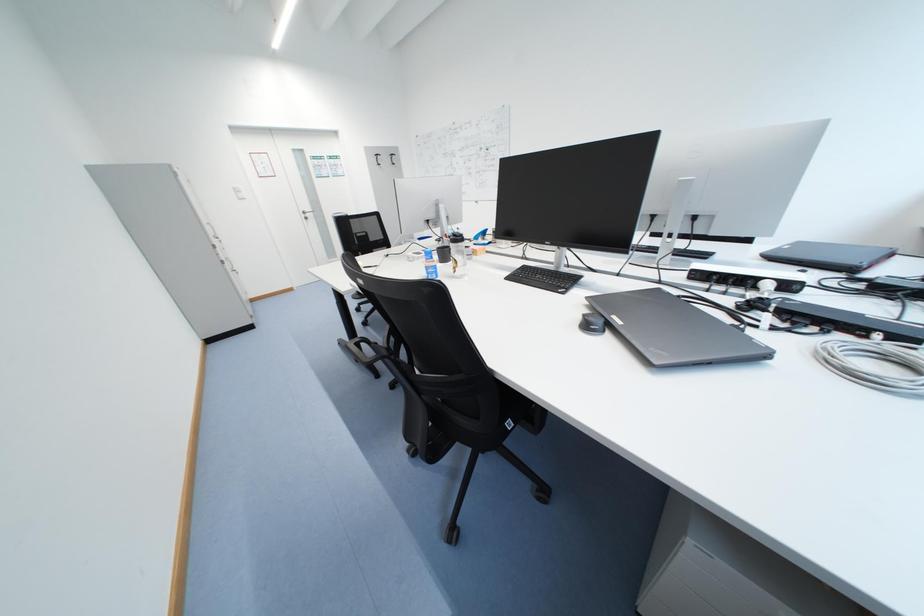
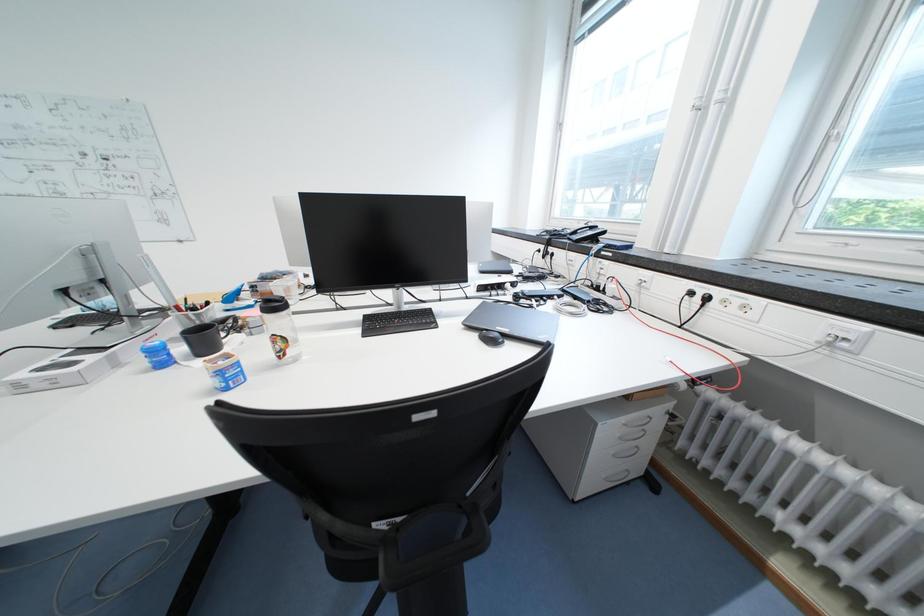
Question: Based on the continuous images, in which direction is the camera rotating? Reply with the corresponding letter.

Choices:
 (A) Left
 (B) Right
 (C) Up
 (D) Down

Answer: (B)